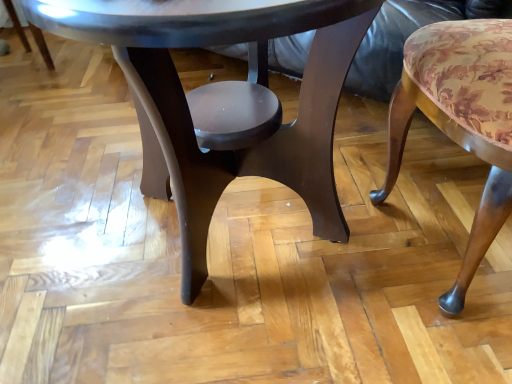
Image resolution: width=512 pixels, height=384 pixels. What are the coordinates of `free space that is in between glossy dark wood coffee table at center and floral fabric cushion at right` in the screenshot? It's located at (369, 238).